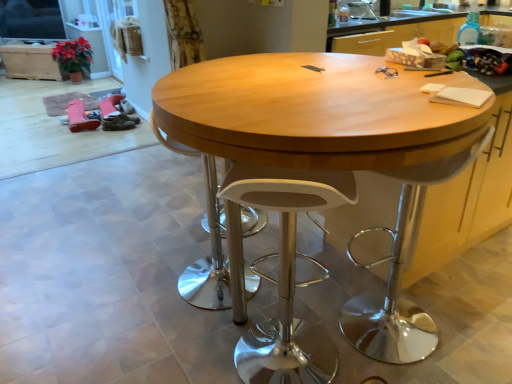
Question: Relative to white plastic swivel chair at center, the first swivel chair when ordered from left to right, is white plastic swivel chair at right, which is counted as the 2th swivel chair, starting from the left, in front or behind?

Choices:
 (A) front
 (B) behind

Answer: (A)

Question: Looking at their shapes, would you say white plastic swivel chair at right, which is counted as the 2th swivel chair, starting from the left, is wider or thinner than white plastic swivel chair at center, the first swivel chair when ordered from left to right?

Choices:
 (A) wide
 (B) thin

Answer: (B)

Question: Which object is the closest to the wooden cabinet at upper left?

Choices:
 (A) white plastic stool at center
 (B) white plastic swivel chair at center, the first swivel chair when ordered from left to right
 (C) white plastic swivel chair at right, which is counted as the 2th swivel chair, starting from the left
 (D) wooden table at center

Answer: (B)

Question: Which is nearer to the white plastic swivel chair at right, which is counted as the 2th swivel chair, starting from the left?

Choices:
 (A) wooden cabinet at upper left
 (B) white plastic swivel chair at center, the second swivel chair viewed from the right
 (C) white plastic stool at center
 (D) wooden table at center

Answer: (C)